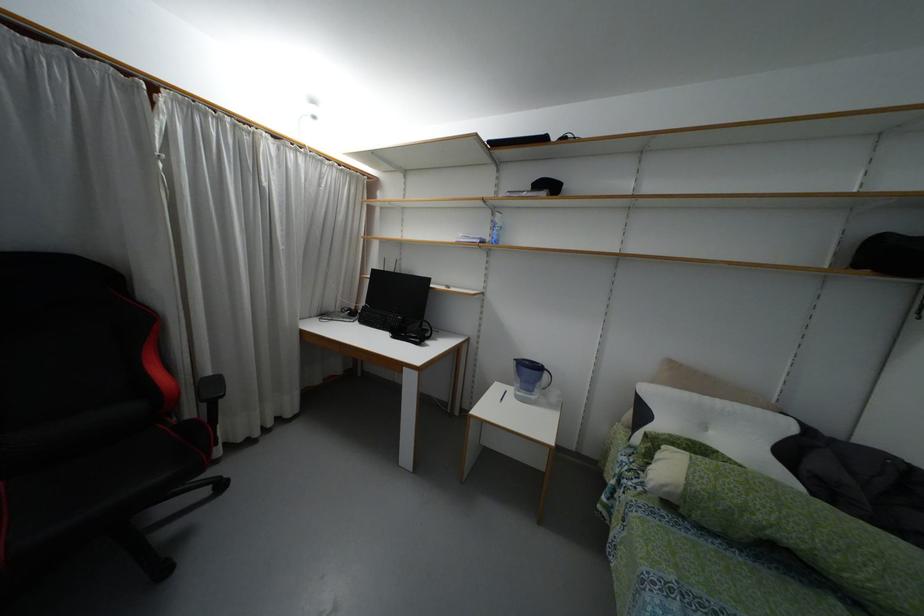
Image resolution: width=924 pixels, height=616 pixels. What are the coordinates of `chair sitting surface` in the screenshot? It's located at [108, 476].